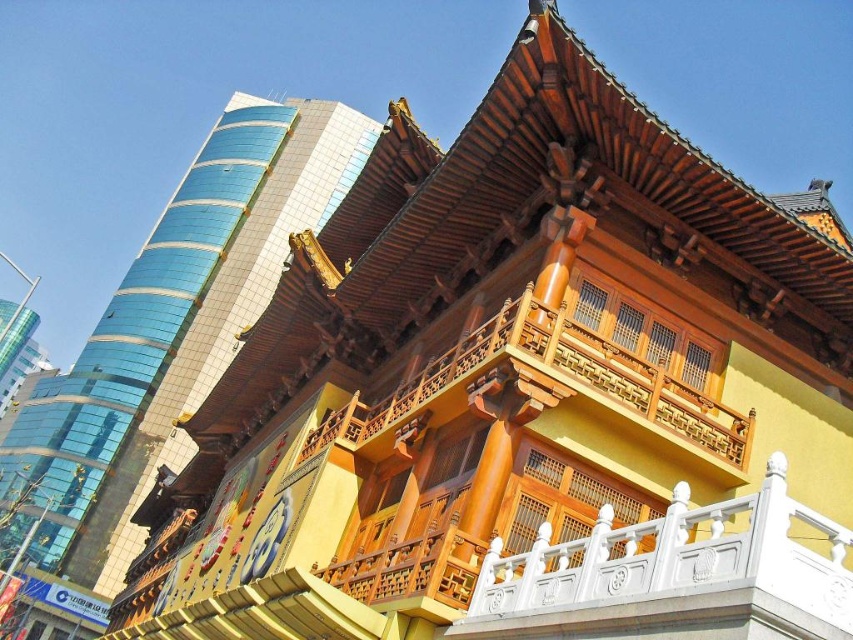
Based on the photo, between yellow wood temple at center and white stone balustrade at center, which one appears on the right side from the viewer's perspective?

From the viewer's perspective, white stone balustrade at center appears more on the right side.

Is yellow wood temple at center shorter than white stone balustrade at center?

Incorrect, yellow wood temple at center's height does not fall short of white stone balustrade at center's.

Looking at this image, who is more forward, (149, 365) or (744, 541)?

Point (744, 541)

Where is `yellow wood temple at center`? yellow wood temple at center is located at coordinates (169, 337).

Which of these two, white stone balustrade at center or wooden balcony at center, stands taller?

Standing taller between the two is wooden balcony at center.

Is point (724, 554) farther from viewer compared to point (666, 385)?

No, it is not.

Find the location of a particular element. The width and height of the screenshot is (853, 640). white stone balustrade at center is located at coordinates (674, 576).

Is yellow wood temple at center bigger than wooden balcony at center?

Indeed, yellow wood temple at center has a larger size compared to wooden balcony at center.

Can you confirm if yellow wood temple at center is shorter than wooden balcony at center?

In fact, yellow wood temple at center may be taller than wooden balcony at center.

What do you see at coordinates (169, 337) in the screenshot? I see `yellow wood temple at center` at bounding box center [169, 337].

Where is `yellow wood temple at center`? The height and width of the screenshot is (640, 853). yellow wood temple at center is located at coordinates (169, 337).